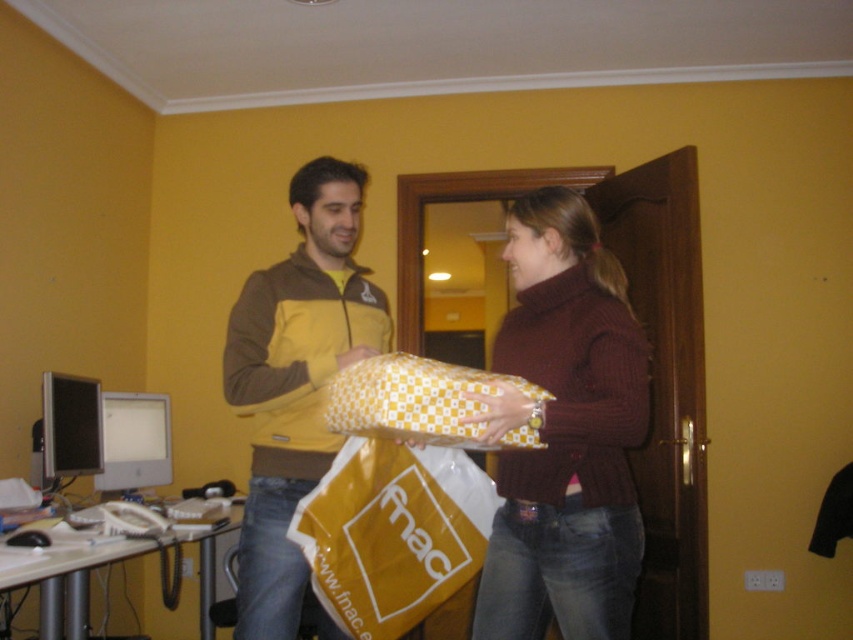
Between yellow checkered paper at center and knitted maroon sweater at center, which one appears on the left side from the viewer's perspective?

From the viewer's perspective, yellow checkered paper at center appears more on the left side.

Between yellow checkered paper at center and knitted maroon sweater at center, which one is positioned lower?

yellow checkered paper at center

Who is more forward, (x=306, y=369) or (x=523, y=472)?

Point (x=523, y=472)

Where is `yellow checkered paper at center`? yellow checkered paper at center is located at coordinates (289, 392).

Is point (489, 420) positioned after point (485, 552)?

No, it is in front of (485, 552).

Consider the image. Can you confirm if knitted maroon sweater at center is thinner than yellow paper shopping bag at center?

Indeed, knitted maroon sweater at center has a lesser width compared to yellow paper shopping bag at center.

Does point (634, 349) come behind point (426, 476)?

No, it is in front of (426, 476).

This screenshot has width=853, height=640. Identify the location of knitted maroon sweater at center. (564, 433).

Does yellow checkered paper at center come behind yellow matte jacket at center?

Yes.

Identify the location of yellow checkered paper at center. (289, 392).